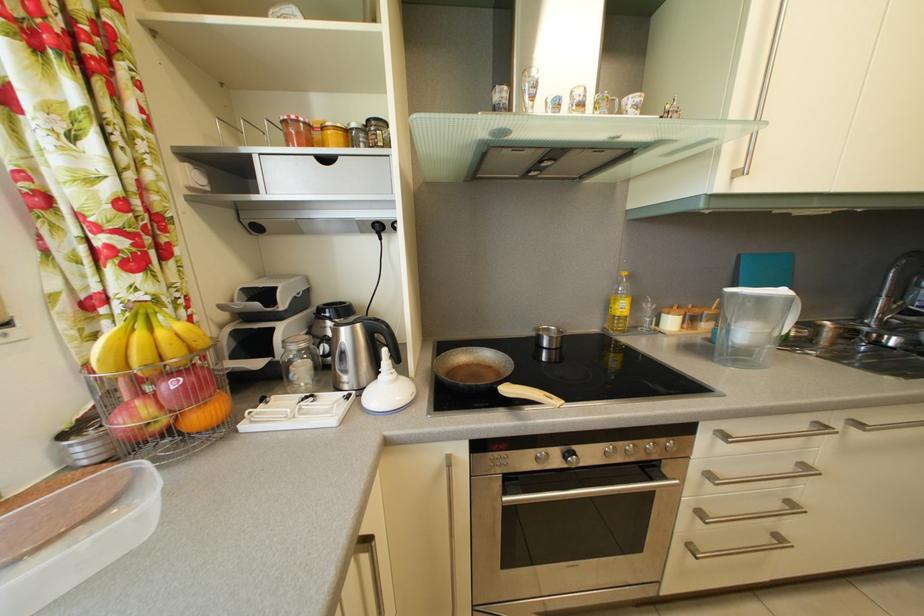
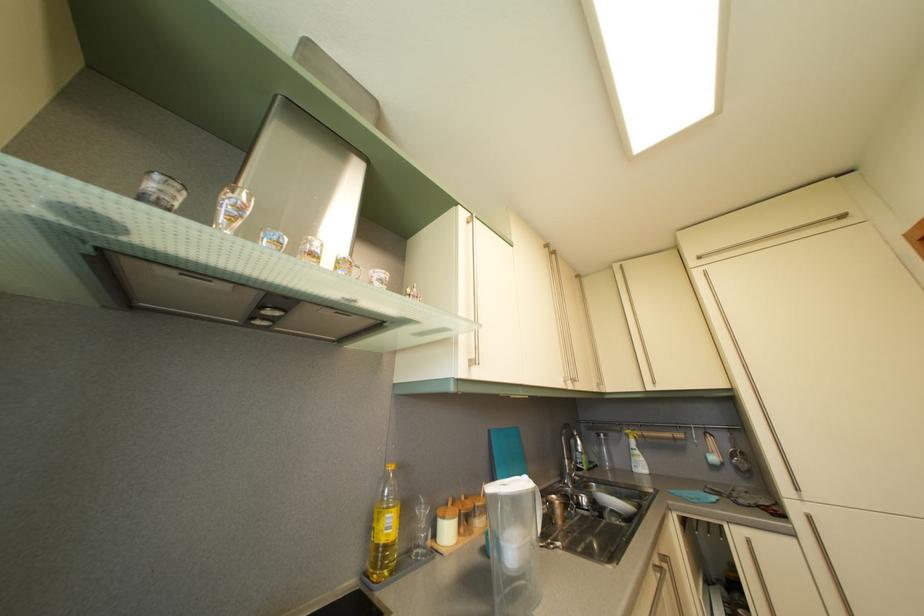
Where in the second image is the point corresponding to point 629,315 from the first image?

(396, 533)